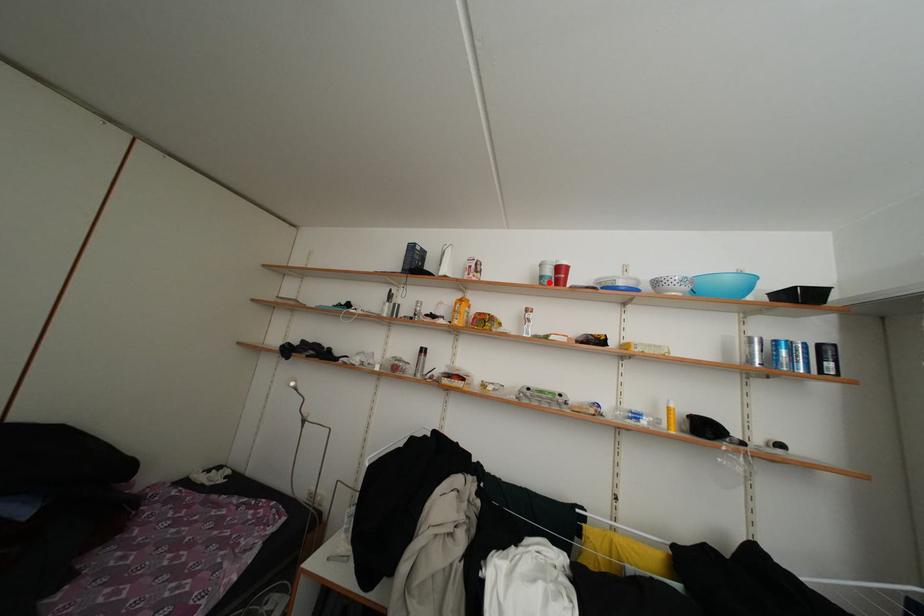
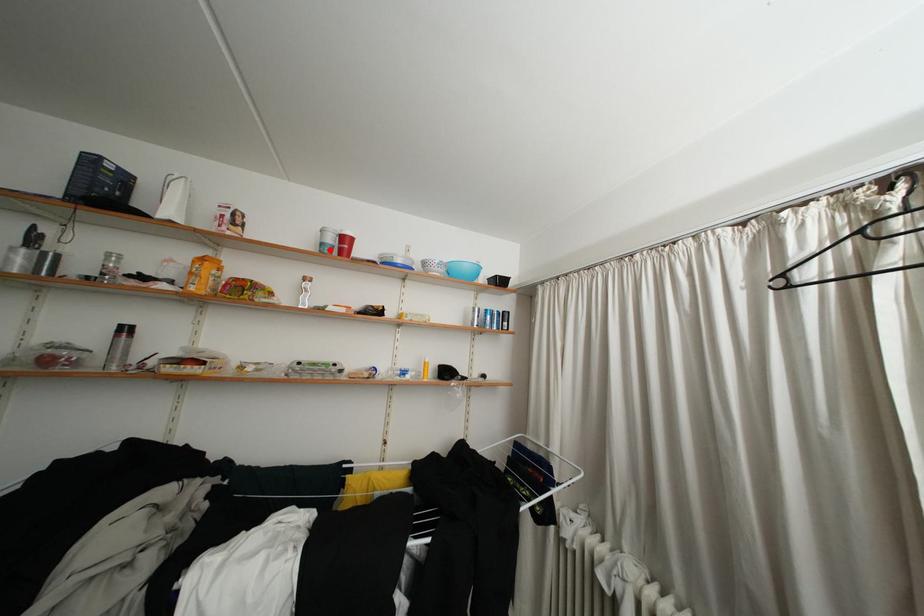
I am providing you with two images of the same scene from different viewpoints. A red point is marked on the first image and another point is marked on the second image. Do the highlighted points in image1 and image2 indicate the same real-world spot?

Yes